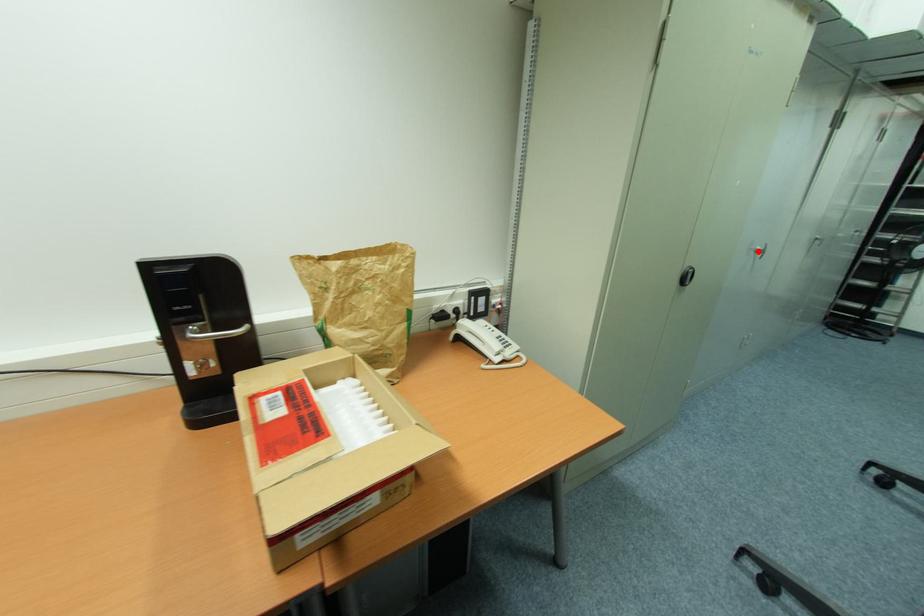
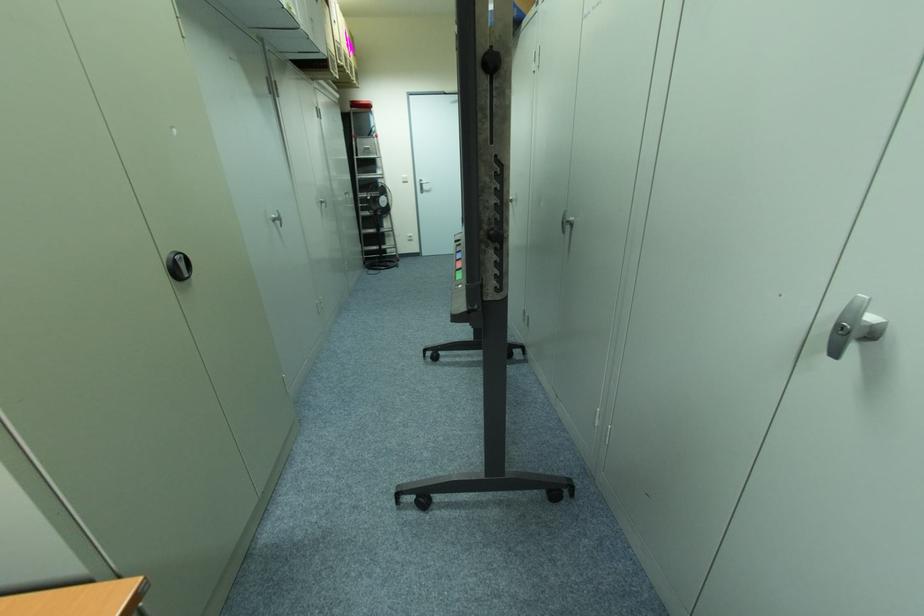
In the second image, find the point that corresponds to the highlighted location in the first image.

(274, 220)